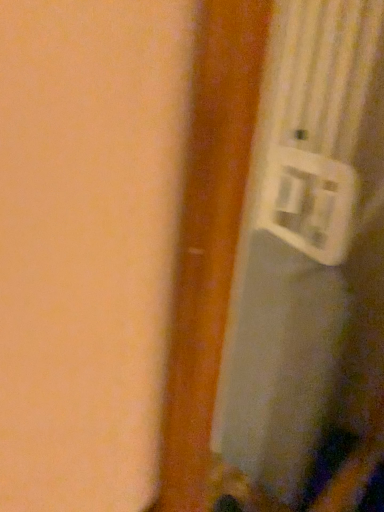
This screenshot has width=384, height=512. What do you see at coordinates (309, 271) in the screenshot?
I see `white plastic radiator at right` at bounding box center [309, 271].

Find the location of a particular element. white plastic radiator at right is located at coordinates (309, 271).

Image resolution: width=384 pixels, height=512 pixels. Identify the location of white plastic radiator at right. (309, 271).